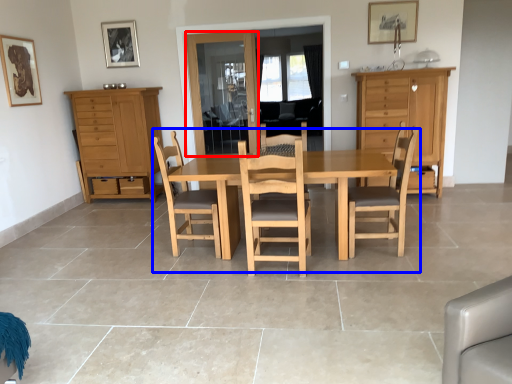
Question: Which point is further to the camera, glass door (highlighted by a red box) or kitchen & dining room table (highlighted by a blue box)?

Choices:
 (A) glass door
 (B) kitchen & dining room table

Answer: (A)